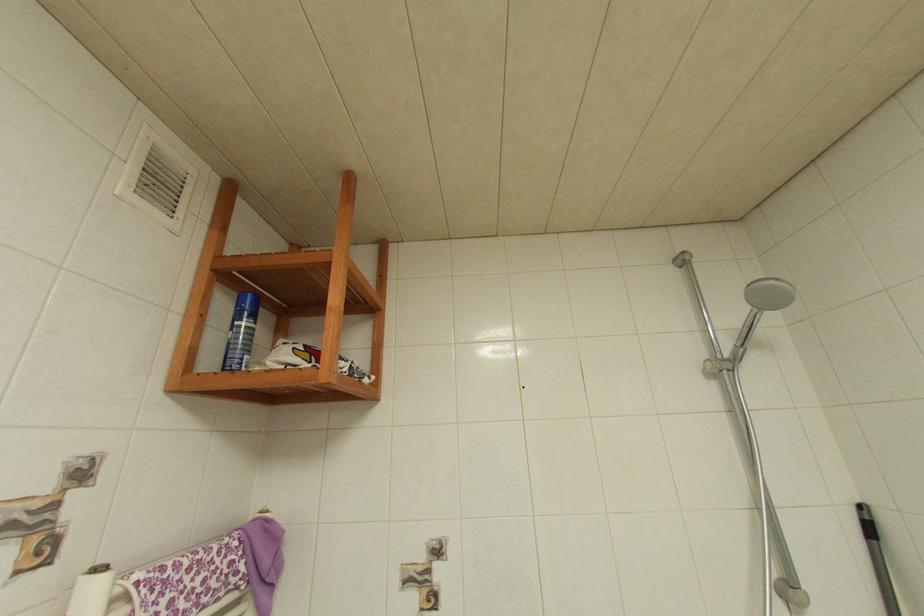
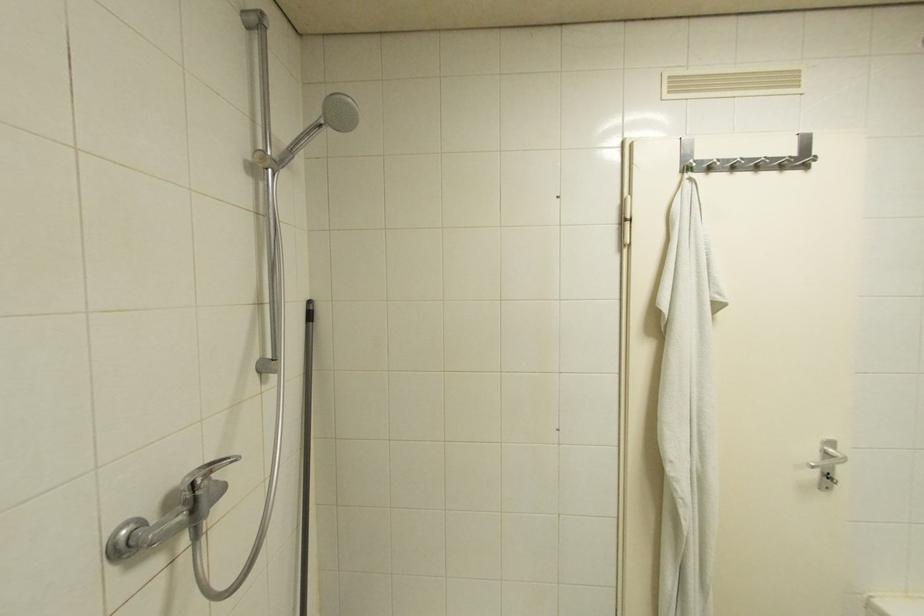
Question: The camera is either moving clockwise (left) or counter-clockwise (right) around the object. The first image is from the beginning of the video and the second image is from the end. Is the camera moving left or right when shooting the video?

Choices:
 (A) Left
 (B) Right

Answer: (A)